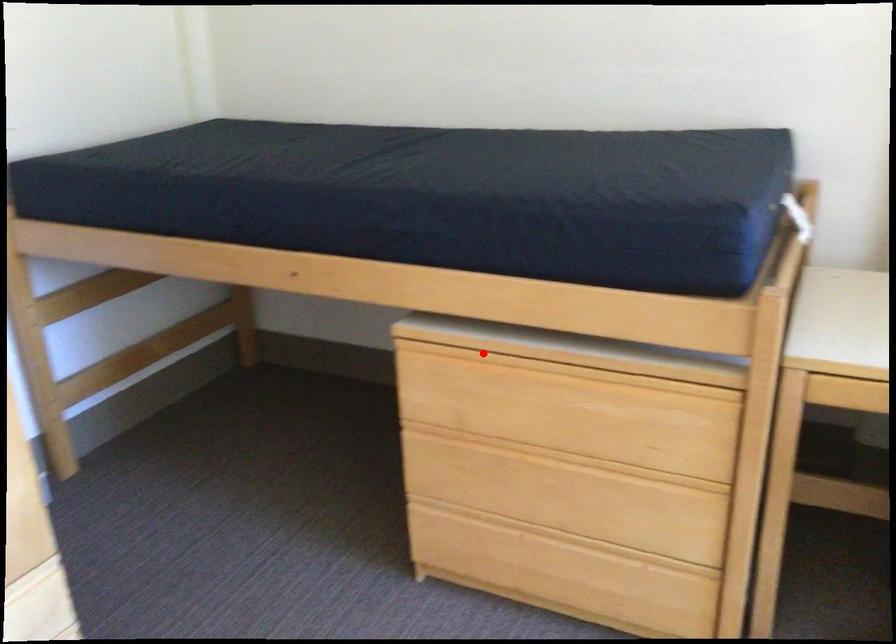
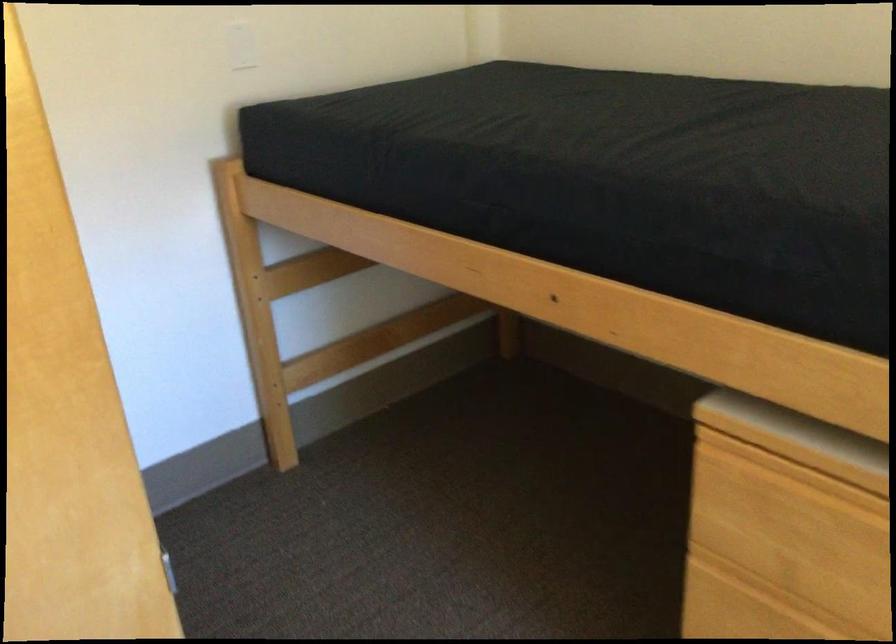
Locate, in the second image, the point that corresponds to the highlighted location in the first image.

(837, 474)